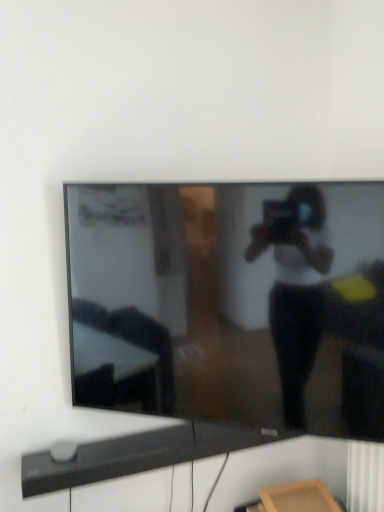
Find the location of a particular element. free space above black matte soundbar at lower center (from a real-world perspective) is located at coordinates (155, 438).